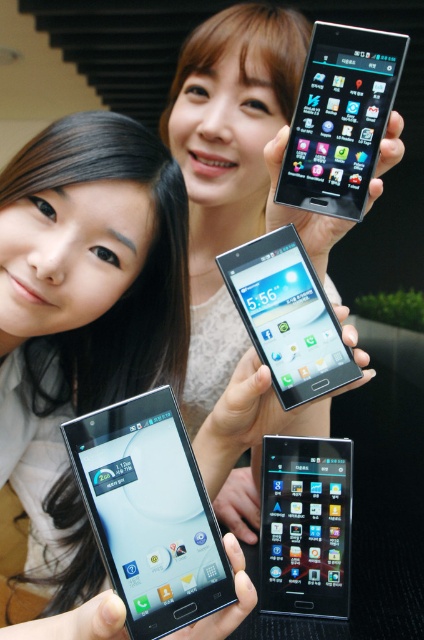
Question: Does matte white phone at upper center appear over matte black smartphone at center?

Choices:
 (A) yes
 (B) no

Answer: (A)

Question: Which of the following is the closest to the observer?

Choices:
 (A) satin black smartphone at center
 (B) satin black smartphone at upper center
 (C) matte black smartphone at center
 (D) matte white phone at upper center

Answer: (D)

Question: Is matte black phone at lower left above matte black smartphone at center?

Choices:
 (A) yes
 (B) no

Answer: (B)

Question: Which point is farther from the camera taking this photo?

Choices:
 (A) (113, 570)
 (B) (264, 332)
 (C) (139, 195)
 (D) (345, 611)

Answer: (D)

Question: Which object is positioned closest to the matte white phone at upper center?

Choices:
 (A) satin black smartphone at center
 (B) satin black smartphone at upper center
 (C) matte black smartphone at lower left

Answer: (B)

Question: Is satin black smartphone at upper center to the left of satin black smartphone at center from the viewer's perspective?

Choices:
 (A) no
 (B) yes

Answer: (A)